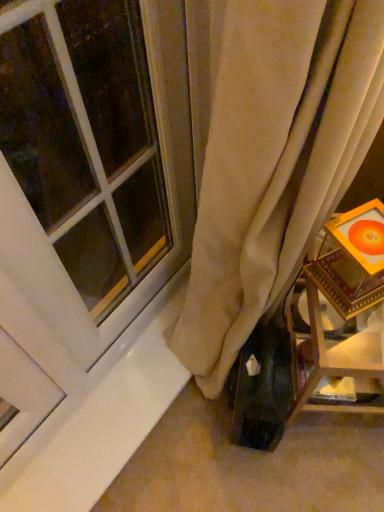
At what (x,y) coordinates should I click in order to perform the action: click on wooden framed picture at right. Please return your answer as a coordinate pair (x, y). The height and width of the screenshot is (512, 384). Looking at the image, I should click on pyautogui.click(x=345, y=307).

The width and height of the screenshot is (384, 512). Describe the element at coordinates (345, 307) in the screenshot. I see `wooden framed picture at right` at that location.

What is the approximate width of white glass window at upper left?

The width of white glass window at upper left is 2.98 inches.

What do you see at coordinates (94, 160) in the screenshot? I see `white glass window at upper left` at bounding box center [94, 160].

Find the location of a particular element. The image size is (384, 512). white glass window at upper left is located at coordinates (94, 160).

What is the approximate height of white glass window at upper left?

32.39 inches.

Where is `wooden framed picture at right`? wooden framed picture at right is located at coordinates (345, 307).

Can you confirm if wooden framed picture at right is positioned to the right of white glass window at upper left?

Indeed, wooden framed picture at right is positioned on the right side of white glass window at upper left.

Considering the relative positions of wooden framed picture at right and white glass window at upper left in the image provided, is wooden framed picture at right in front of white glass window at upper left?

No.

Is point (307, 388) farther from camera compared to point (119, 190)?

No.

From the image's perspective, which one is positioned lower, wooden framed picture at right or white glass window at upper left?

wooden framed picture at right appears lower in the image.

From a real-world perspective, who is located lower, wooden framed picture at right or white glass window at upper left?

wooden framed picture at right.

Considering the sizes of wooden framed picture at right and white glass window at upper left in the image, is wooden framed picture at right wider or thinner than white glass window at upper left?

wooden framed picture at right is wider than white glass window at upper left.

Who is taller, wooden framed picture at right or white glass window at upper left?

Standing taller between the two is white glass window at upper left.

Looking at this image, considering the relative sizes of wooden framed picture at right and white glass window at upper left in the image provided, is wooden framed picture at right smaller than white glass window at upper left?

No.

Would you say wooden framed picture at right contains white glass window at upper left?

No, white glass window at upper left is located outside of wooden framed picture at right.

Are wooden framed picture at right and white glass window at upper left far apart?

They are positioned close to each other.

Is white glass window at upper left at the back of wooden framed picture at right?

No.

At what (x,y) coordinates should I click in order to perform the action: click on furniture below the white glass window at upper left (from a real-world perspective). Please return your answer as a coordinate pair (x, y). Image resolution: width=384 pixels, height=512 pixels. Looking at the image, I should click on (345, 307).

Which object is positioned more to the right, white glass window at upper left or wooden framed picture at right?

wooden framed picture at right.

In the scene shown: Is white glass window at upper left positioned before wooden framed picture at right?

Yes.

Does point (30, 57) come closer to viewer compared to point (377, 349)?

No, (30, 57) is behind (377, 349).

From the image's perspective, is white glass window at upper left located above wooden framed picture at right?

Yes, from the image's perspective, white glass window at upper left is above wooden framed picture at right.

From the picture: From a real-world perspective, is white glass window at upper left over wooden framed picture at right?

Correct, in the physical world, white glass window at upper left is higher than wooden framed picture at right.

Based on the photo, which object is wider, white glass window at upper left or wooden framed picture at right?

Wider between the two is wooden framed picture at right.

Considering the sizes of objects white glass window at upper left and wooden framed picture at right in the image provided, who is shorter, white glass window at upper left or wooden framed picture at right?

With less height is wooden framed picture at right.

Can you confirm if white glass window at upper left is bigger than wooden framed picture at right?

No.

Choose the correct answer: Is white glass window at upper left inside wooden framed picture at right or outside it?

white glass window at upper left exists outside the volume of wooden framed picture at right.

Is there a large distance between white glass window at upper left and wooden framed picture at right?

That's not correct — white glass window at upper left is a little close to wooden framed picture at right.

Is white glass window at upper left oriented towards wooden framed picture at right?

Yes, white glass window at upper left is aimed at wooden framed picture at right.

Looking at this image, how different are the orientations of white glass window at upper left and wooden framed picture at right in degrees?

white glass window at upper left and wooden framed picture at right are facing 56.2 degrees away from each other.

The image size is (384, 512). I want to click on window located in front of the wooden framed picture at right, so click(x=94, y=160).

Identify the location of furniture below the white glass window at upper left (from the image's perspective). (345, 307).

Find the location of a particular element. This screenshot has width=384, height=512. window on the left of wooden framed picture at right is located at coordinates (94, 160).